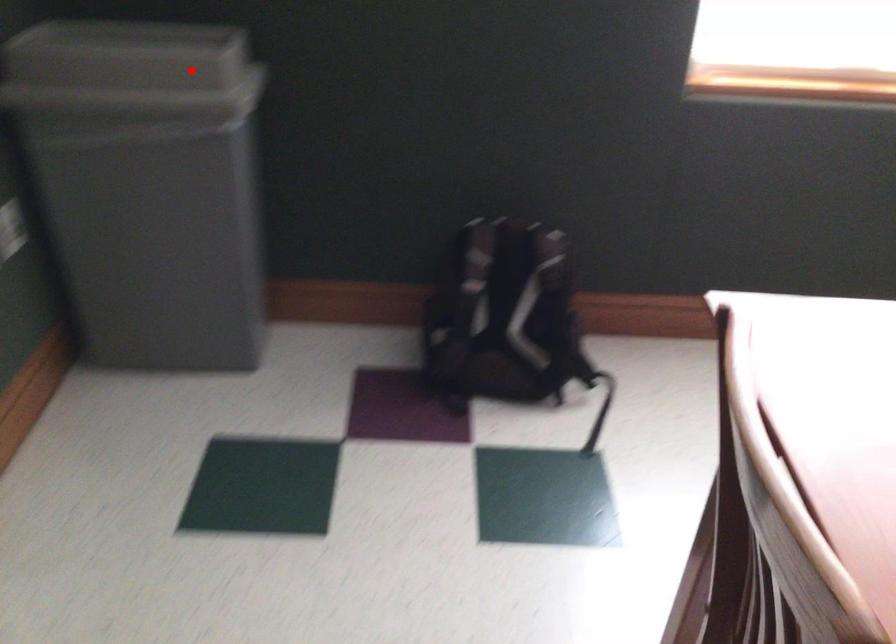
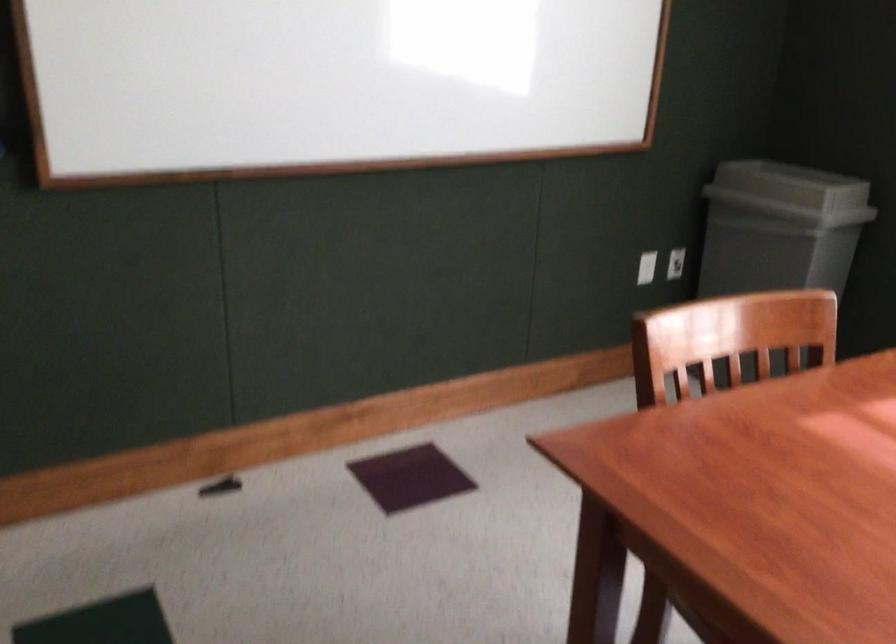
The point at the highlighted location is marked in the first image. Where is the corresponding point in the second image?

(791, 185)